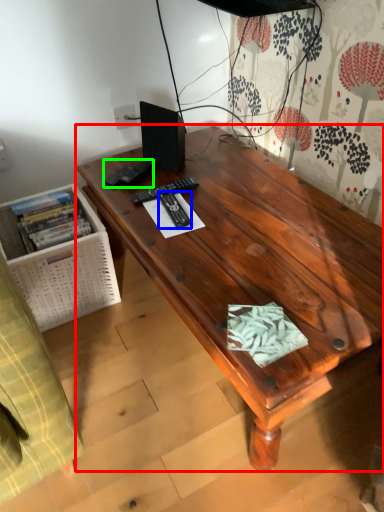
Question: Based on their relative distances, which object is farther from desk (highlighted by a red box)? Choose from remote control (highlighted by a blue box) and remote control (highlighted by a green box).

Choices:
 (A) remote control
 (B) remote control

Answer: (B)